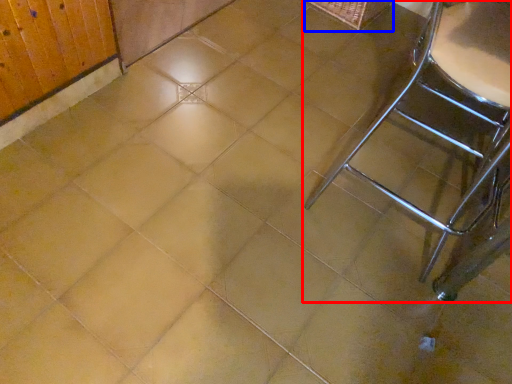
Question: Which object is closer to the camera taking this photo, furniture (highlighted by a red box) or basket (highlighted by a blue box)?

Choices:
 (A) furniture
 (B) basket

Answer: (A)